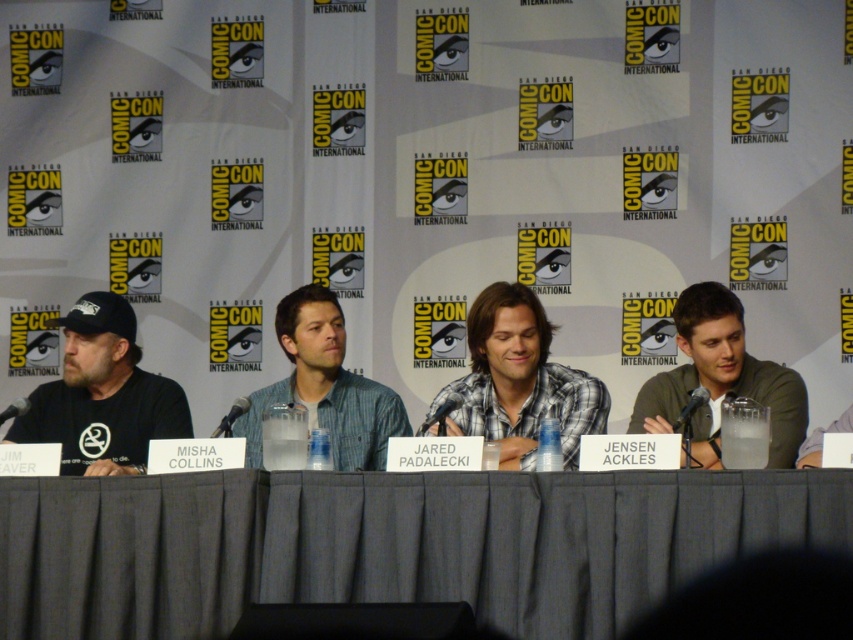
Question: Is the position of checkered fabric shirt at center less distant than that of green matte shirt at right?

Choices:
 (A) no
 (B) yes

Answer: (A)

Question: Is black t-shirt at left thinner than blue denim shirt at center?

Choices:
 (A) yes
 (B) no

Answer: (B)

Question: From the image, what is the correct spatial relationship of gray fabric table at center in relation to blue denim shirt at center?

Choices:
 (A) above
 (B) below

Answer: (B)

Question: Which of the following is the closest to the observer?

Choices:
 (A) (184, 428)
 (B) (727, 314)
 (C) (314, 410)
 (D) (596, 582)

Answer: (D)

Question: Which is nearer to the gray fabric table at center?

Choices:
 (A) checkered fabric shirt at center
 (B) green matte shirt at right
 (C) blue denim shirt at center

Answer: (A)

Question: Which point appears farthest from the camera in this image?

Choices:
 (A) [717, 429]
 (B) [517, 612]
 (C) [109, 358]

Answer: (C)